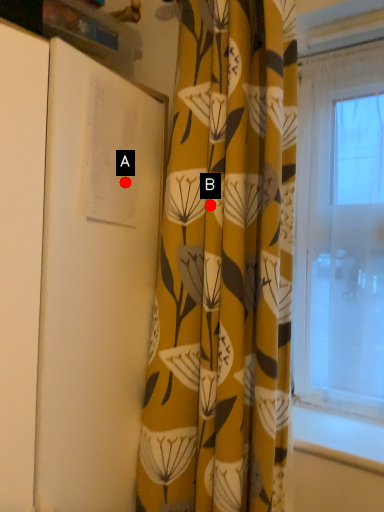
Question: Two points are circled on the image, labeled by A and B beside each circle. Among these points, which one is farthest from the camera?

Choices:
 (A) A is further
 (B) B is further

Answer: (B)